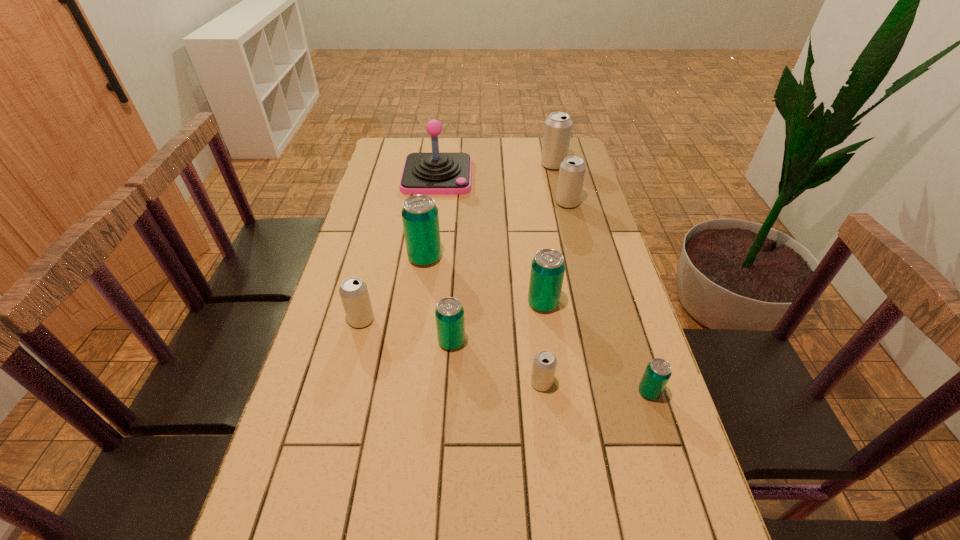
The width and height of the screenshot is (960, 540). What are the coordinates of `object that is positioned at the far left corner` in the screenshot? It's located at (435, 173).

Locate an element on the screen. Image resolution: width=960 pixels, height=540 pixels. object at the far right corner is located at coordinates (557, 131).

Where is `vacant space at the far edge of the desktop`? Image resolution: width=960 pixels, height=540 pixels. vacant space at the far edge of the desktop is located at coordinates pos(510,165).

Identify the location of free space at the left edge of the desktop. The width and height of the screenshot is (960, 540). tap(276, 495).

You are a GUI agent. You are given a task and a screenshot of the screen. Output one action in this format:
    pyautogui.click(x=<x>, y=<y>)
    Task: Click on the vacant position at the right edge of the desktop
    
    Given the screenshot: What is the action you would take?
    pos(587,327)

This screenshot has height=540, width=960. In the image, there is a desktop. Identify the location of vacant space at the far left corner. (394, 150).

At what (x,y) coordinates should I click in order to perform the action: click on vacant space that's between the biggest white beer can and the joystick. Please return your answer as a coordinate pair (x, y). The image size is (960, 540). Looking at the image, I should click on click(495, 170).

Identify the location of empty space that is in between the second nearest white beer can and the third nearest white beer can. The width and height of the screenshot is (960, 540). (465, 261).

This screenshot has height=540, width=960. I want to click on free space between the third biggest teal beer can and the pink joystick, so click(x=444, y=259).

You are a GUI agent. You are given a task and a screenshot of the screen. Output one action in this format:
    pyautogui.click(x=<x>, y=<y>)
    Task: Click on the empty location between the biggest white beer can and the second nearest teal beer can
    This screenshot has width=960, height=540.
    Given the screenshot: What is the action you would take?
    pyautogui.click(x=502, y=253)